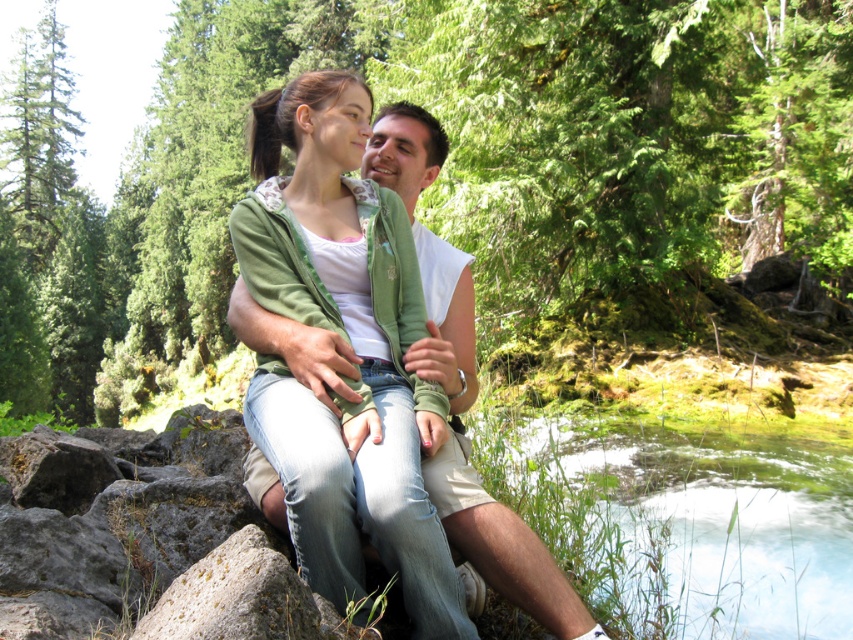
Question: Estimate the real-world distances between objects in this image. Which object is farther from the green matte jacket at center?

Choices:
 (A) smooth gray rock at lower left
 (B) green translucent water at lower right

Answer: (B)

Question: Considering the real-world distances, which object is farthest from the green matte jacket at center?

Choices:
 (A) smooth gray rock at lower left
 (B) green translucent water at lower right

Answer: (B)

Question: Which point is farther from the camera taking this photo?

Choices:
 (A) (640, 490)
 (B) (372, 497)

Answer: (A)

Question: Can you confirm if green matte jacket at center is positioned to the right of green translucent water at lower right?

Choices:
 (A) no
 (B) yes

Answer: (A)

Question: Does green matte jacket at center lie in front of smooth gray rock at lower left?

Choices:
 (A) yes
 (B) no

Answer: (B)

Question: Is green translucent water at lower right smaller than smooth gray rock at lower left?

Choices:
 (A) yes
 (B) no

Answer: (B)